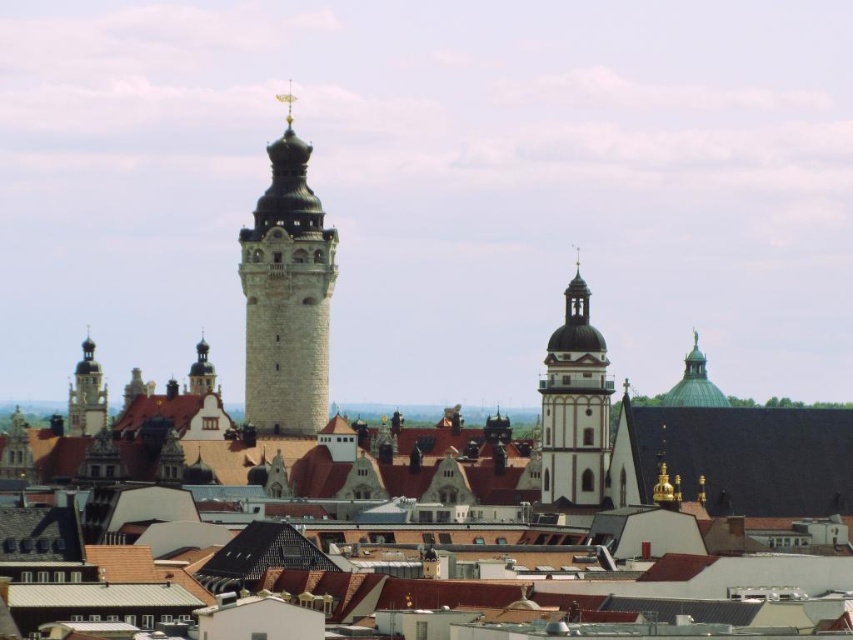
You are an architect analyzing the city layout. You notice the green tile roof at center and the smooth white tower at center. Which of these two structures is located to the right of the other?

The green tile roof at center is positioned on the right side of smooth white tower at center, so the green tile roof is to the right of the smooth white tower.